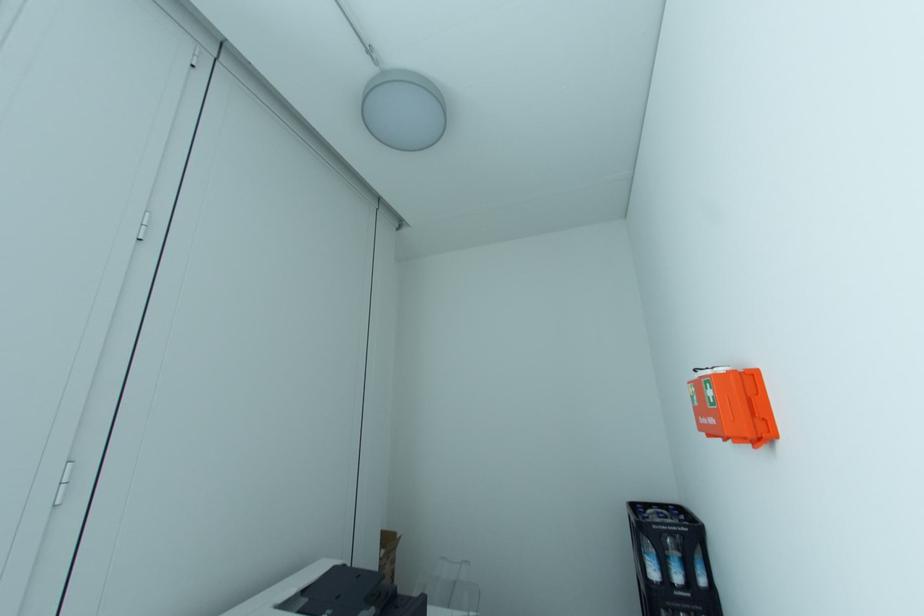
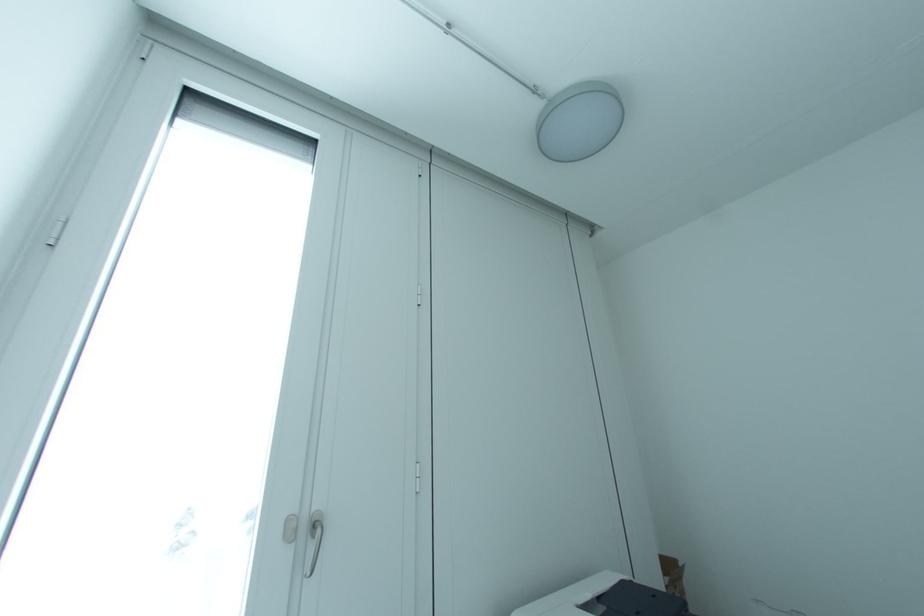
Question: Based on the continuous images, in which direction is the camera rotating? Reply with the corresponding letter.

Choices:
 (A) Left
 (B) Right
 (C) Up
 (D) Down

Answer: (A)